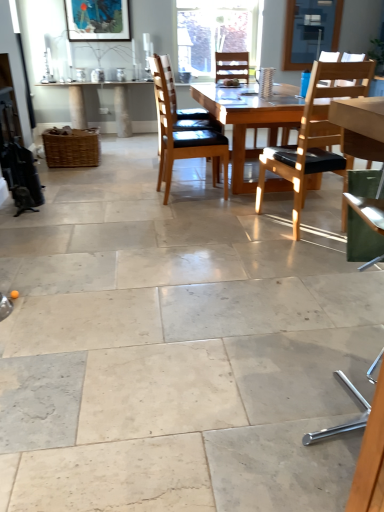
The height and width of the screenshot is (512, 384). Identify the location of vacant space underneath green fabric chair at right, which is the second chair in left-to-right order (from a real-world perspective). (337, 412).